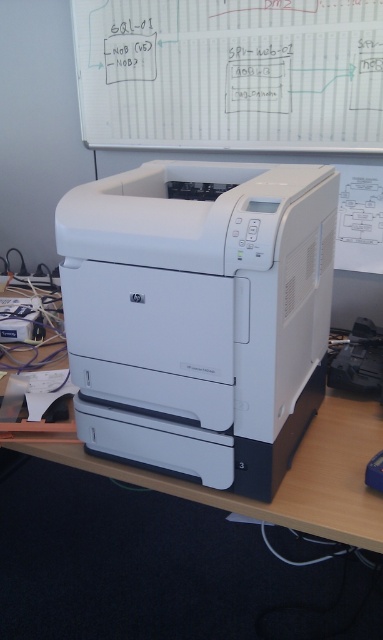
You are setting up an office and need to place a new monitor on the desk. The monitor requires at least 10 cm of space below it to avoid overheating. Given the white plastic printer at center and the white matte computer desk at center, is there enough vertical space between them for the monitor?

The white plastic printer at center is taller than the white matte computer desk at center, so there is insufficient vertical space between them to place the monitor with the required 10 cm clearance below it.

You are standing in an office and want to reach the white matte computer desk at center to retrieve a document. However, there is a white plastic printer at center in your way. Can you walk around the printer to get to the desk?

The white plastic printer at center is closer to the viewer than the white matte computer desk at center, so you can walk around it to reach the desk.

You are standing in an office and see the point marked at coordinates [199,314]. What object is located at that point?

The point at coordinates [199,314] indicates the white plastic printer at center.